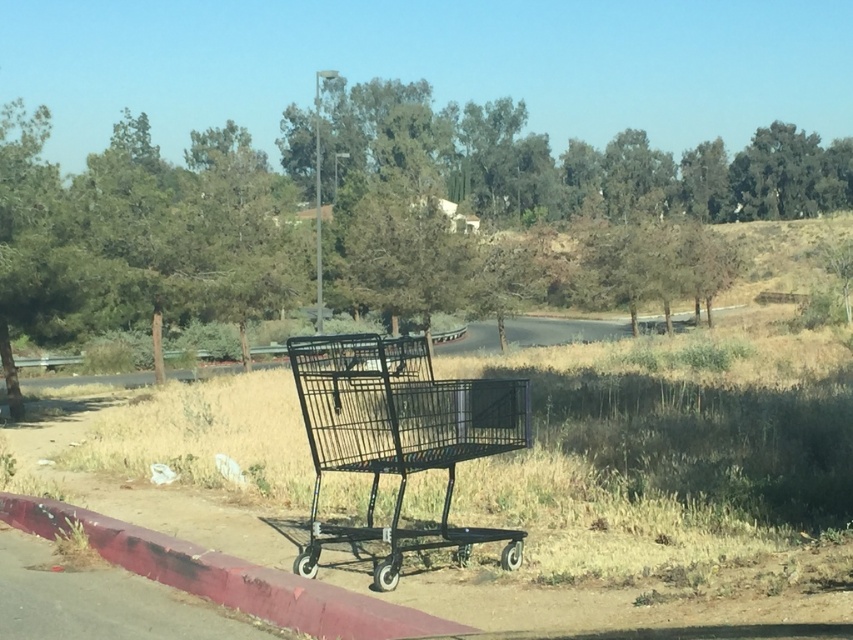
In the scene shown: You are a delivery person trying to park your electric scooter. You see the black wire shopping cart at center and the smooth concrete curb at lower left. Which object is closer to you, and can you park your scooter behind the closer one without it being visible from the road?

The black wire shopping cart at center is closer to you than the smooth concrete curb at lower left. Since the cart is closer, you can park your scooter behind it, and it will be hidden from the road view because the cart blocks the line of sight.

You are a delivery person who needs to park your vehicle next to the black wire shopping cart at center and the smooth concrete curb at lower left. Which object is taller so that it can be used as a reference point for parking alignment?

The black wire shopping cart at center is much taller than the smooth concrete curb at lower left, so it can be used as a reference point for parking alignment.